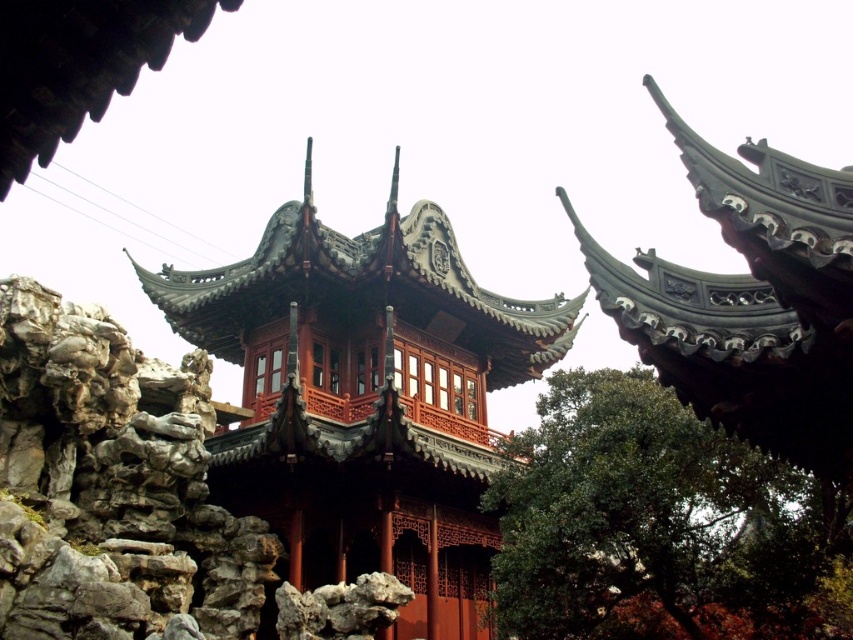
From the picture: Between matte red wooden pavilion at center and rockymaterial/texture at left, which one appears on the right side from the viewer's perspective?

From the viewer's perspective, matte red wooden pavilion at center appears more on the right side.

In the scene shown: Measure the distance from matte red wooden pavilion at center to rockymaterial/texture at left.

A distance of 53.06 feet exists between matte red wooden pavilion at center and rockymaterial/texture at left.

The width and height of the screenshot is (853, 640). Describe the element at coordinates (366, 397) in the screenshot. I see `matte red wooden pavilion at center` at that location.

At what (x,y) coordinates should I click in order to perform the action: click on matte red wooden pavilion at center. Please return your answer as a coordinate pair (x, y). Looking at the image, I should click on (366, 397).

Image resolution: width=853 pixels, height=640 pixels. What are the coordinates of `rockymaterial/texture at left` in the screenshot? It's located at (112, 486).

Does rockymaterial/texture at left have a greater width compared to green leafy tree at center?

Yes.

Where is `rockymaterial/texture at left`? The image size is (853, 640). rockymaterial/texture at left is located at coordinates (112, 486).

At what (x,y) coordinates should I click in order to perform the action: click on rockymaterial/texture at left. Please return your answer as a coordinate pair (x, y). Looking at the image, I should click on (112, 486).

Is matte red wooden pavilion at center closer to the viewer compared to green leafy tree at center?

No, matte red wooden pavilion at center is behind green leafy tree at center.

In the scene shown: Can you confirm if matte red wooden pavilion at center is positioned to the right of green leafy tree at center?

In fact, matte red wooden pavilion at center is to the left of green leafy tree at center.

What do you see at coordinates (366, 397) in the screenshot? Image resolution: width=853 pixels, height=640 pixels. I see `matte red wooden pavilion at center` at bounding box center [366, 397].

What are the coordinates of `matte red wooden pavilion at center` in the screenshot? It's located at click(x=366, y=397).